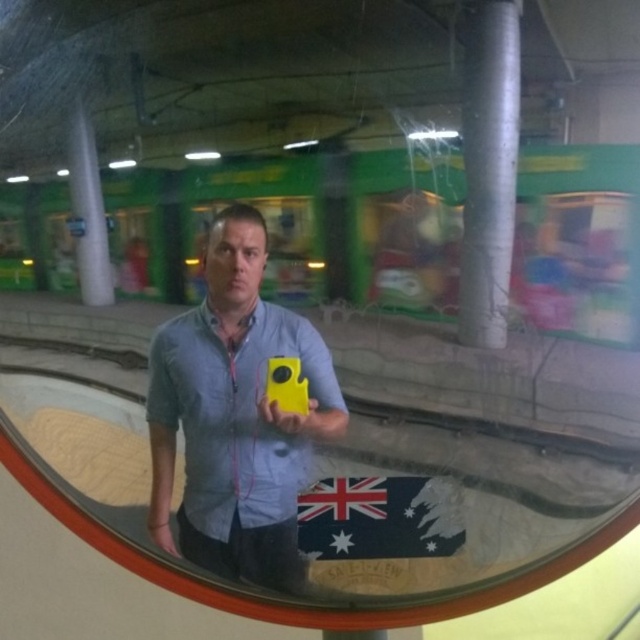
You are a photographer trying to capture a clear image of the dark green fabric flag at center. However, you notice the matte yellow camera at center is blocking your view. Can you determine if the camera is large enough to completely obscure the flag from your current angle?

The matte yellow camera at center has a larger size compared to dark green fabric flag at center, so yes, the camera can completely obscure the flag from your current angle.

You are a photographer trying to capture a photo of the train in the background. You have a matte yellow camera at center and a dark green fabric flag at center. Which object should you move to the right to frame the train better?

You should move the dark green fabric flag at center to the right since the matte yellow camera at center is currently on its left side, allowing space to adjust the flag for better framing.